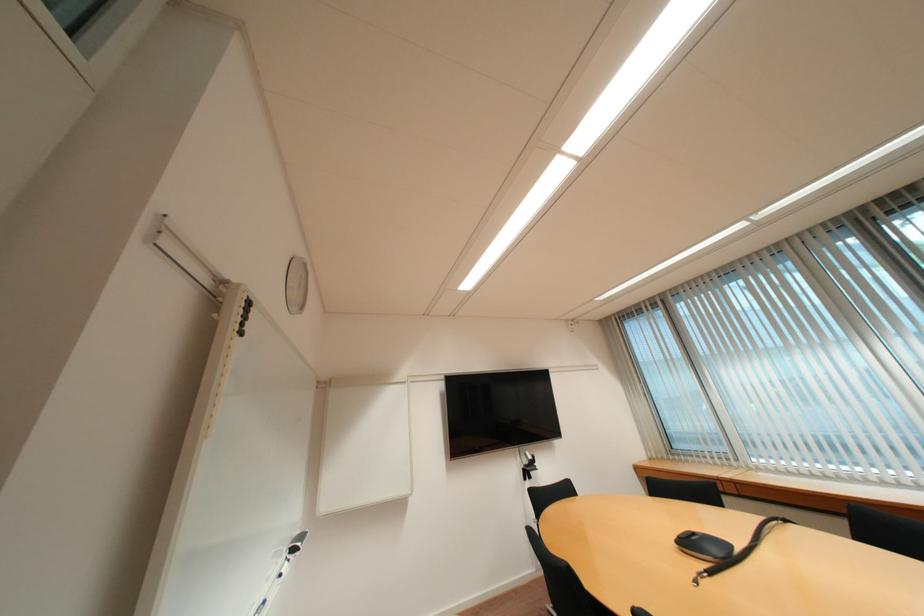
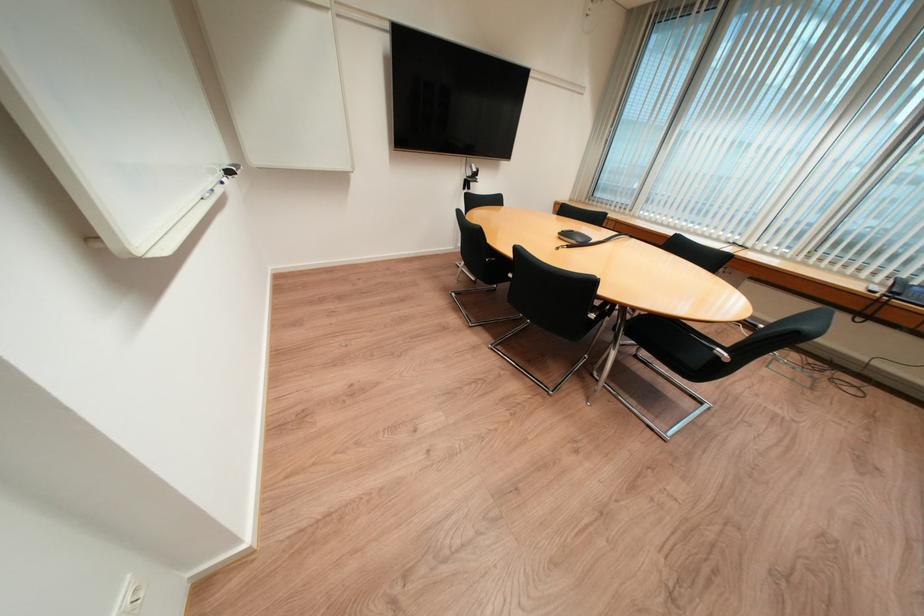
The point at [532,471] is marked in the first image. Where is the corresponding point in the second image?

(473, 182)